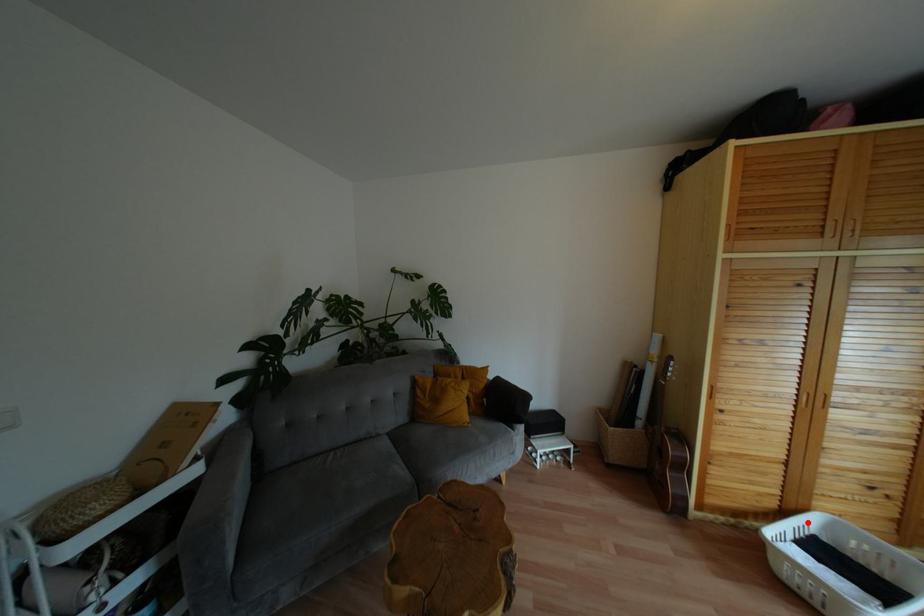
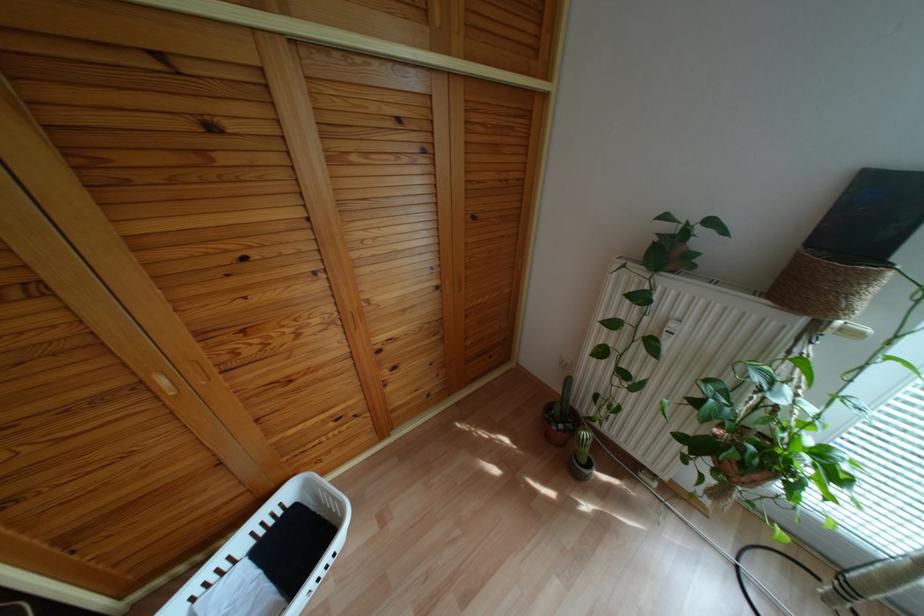
Question: I am providing you with two images of the same scene from different viewpoints. Given a red point in image1, look at the same physical point in image2. Is it:

Choices:
 (A) Closer to the viewpoint
 (B) Farther from the viewpoint

Answer: (A)